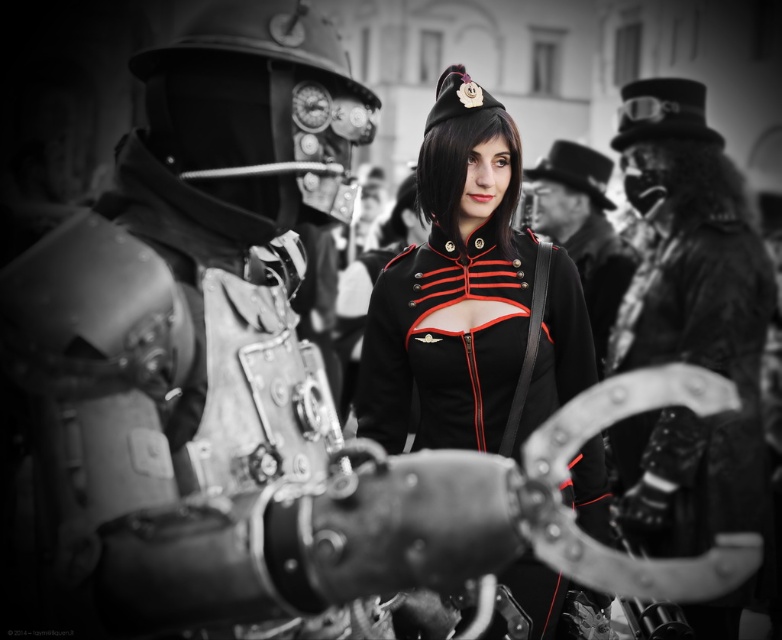
Can you confirm if black matte uniform at center is thinner than black leather jacket at center?

No, black matte uniform at center is not thinner than black leather jacket at center.

Is black matte uniform at center to the right of black leather jacket at center from the viewer's perspective?

Incorrect, black matte uniform at center is not on the right side of black leather jacket at center.

Where is `black matte uniform at center`? black matte uniform at center is located at coordinates (472, 298).

Is point (555, 364) in front of point (716, 451)?

Yes, it is in front of point (716, 451).

Between black matte uniform at center and fur coat at right, which one is positioned lower?

Positioned lower is fur coat at right.

Does point (589, 474) come in front of point (633, 324)?

Yes, it is.

You are a GUI agent. You are given a task and a screenshot of the screen. Output one action in this format:
    pyautogui.click(x=<x>, y=<y>)
    Task: Click on the black matte uniform at center
    The height and width of the screenshot is (640, 782).
    Given the screenshot: What is the action you would take?
    pyautogui.click(x=472, y=298)

Is fur coat at right positioned behind black leather jacket at center?

No.

Which is more to the left, fur coat at right or black leather jacket at center?

From the viewer's perspective, fur coat at right appears more on the left side.

Between point (723, 236) and point (628, 252), which one is positioned behind?

Point (628, 252)

Where is `fur coat at right`? This screenshot has width=782, height=640. fur coat at right is located at coordinates (687, 326).